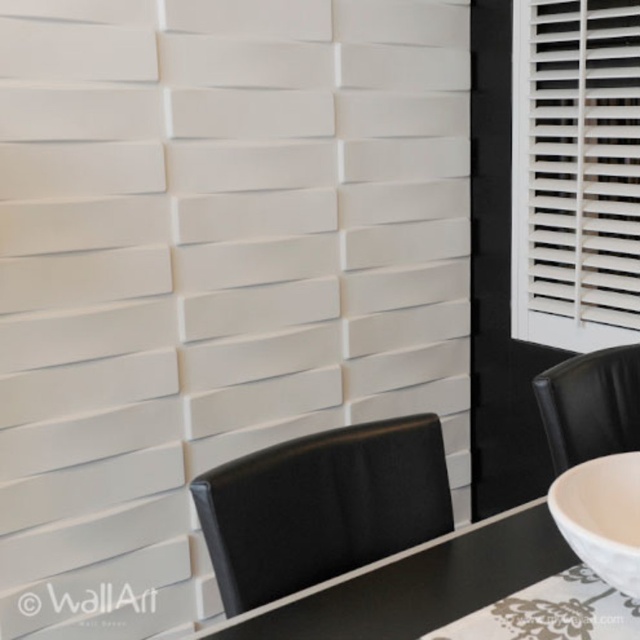
Question: Is black leather chair at center closer to camera compared to black leather chair at right?

Choices:
 (A) yes
 (B) no

Answer: (A)

Question: Is white matte shutter at right behind white glossy bowl at lower right?

Choices:
 (A) no
 (B) yes

Answer: (B)

Question: Does white plastic blinds at upper right appear over black leather chair at right?

Choices:
 (A) no
 (B) yes

Answer: (B)

Question: Among these objects, which one is nearest to the camera?

Choices:
 (A) black leather chair at center
 (B) black leather chair at right
 (C) white matte shutter at right

Answer: (A)

Question: Which point is farther to the camera?

Choices:
 (A) (630, 157)
 (B) (228, 51)
 (C) (625, 346)
 (D) (564, 493)

Answer: (A)

Question: Estimate the real-world distances between objects in this image. Which object is farther from the black leather chair at center?

Choices:
 (A) white matte shutter at right
 (B) white glossy bowl at lower right
 (C) black leather chair at right

Answer: (A)